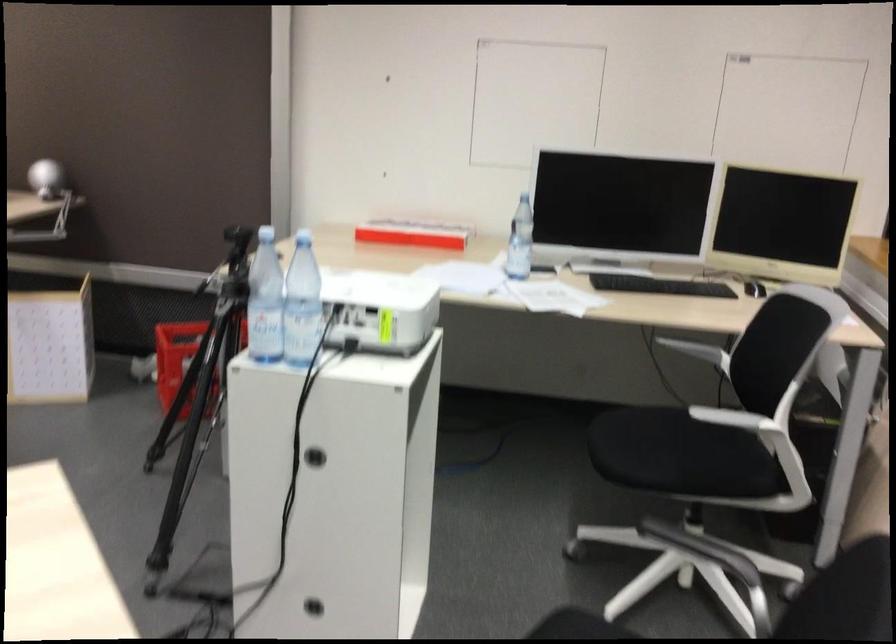
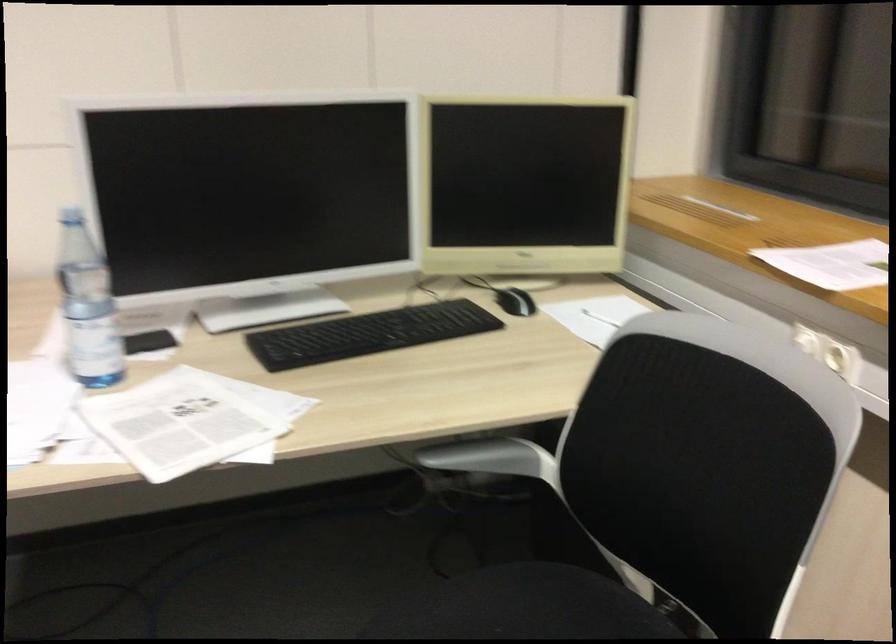
Question: In a continuous first-person perspective shot, in which direction is the camera moving?

Choices:
 (A) Left
 (B) Right
 (C) Forward
 (D) Backward

Answer: (C)